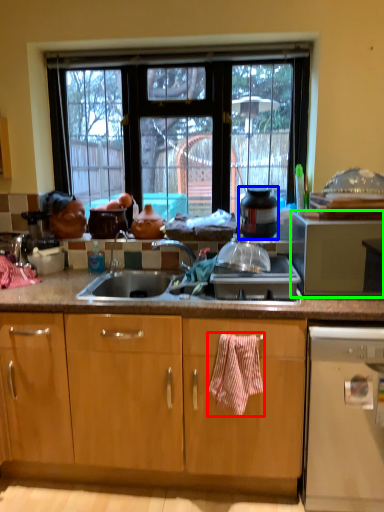
Question: Based on their relative distances, which object is nearer to blanket (highlighted by a red box)? Choose from appliance (highlighted by a blue box) and microwave oven (highlighted by a green box).

Choices:
 (A) appliance
 (B) microwave oven

Answer: (A)